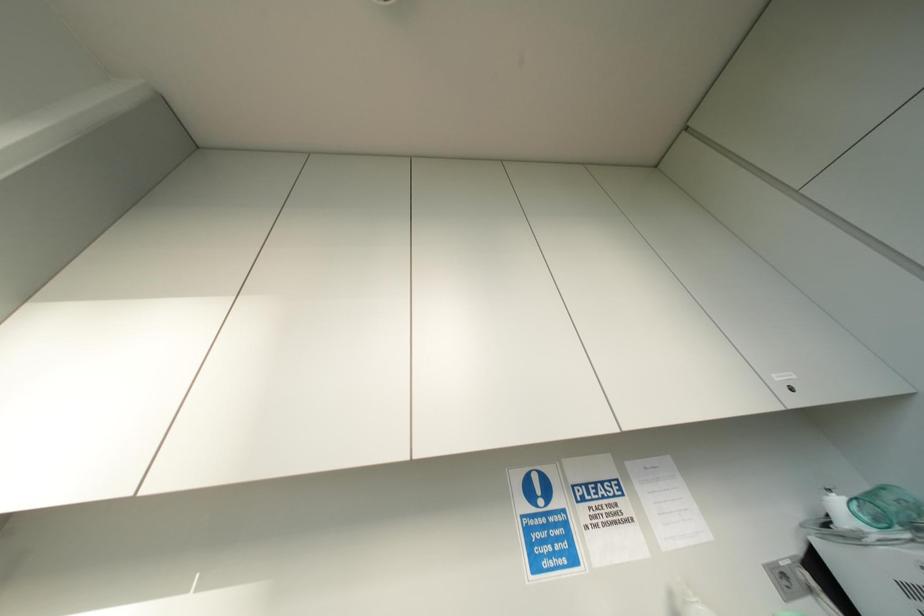
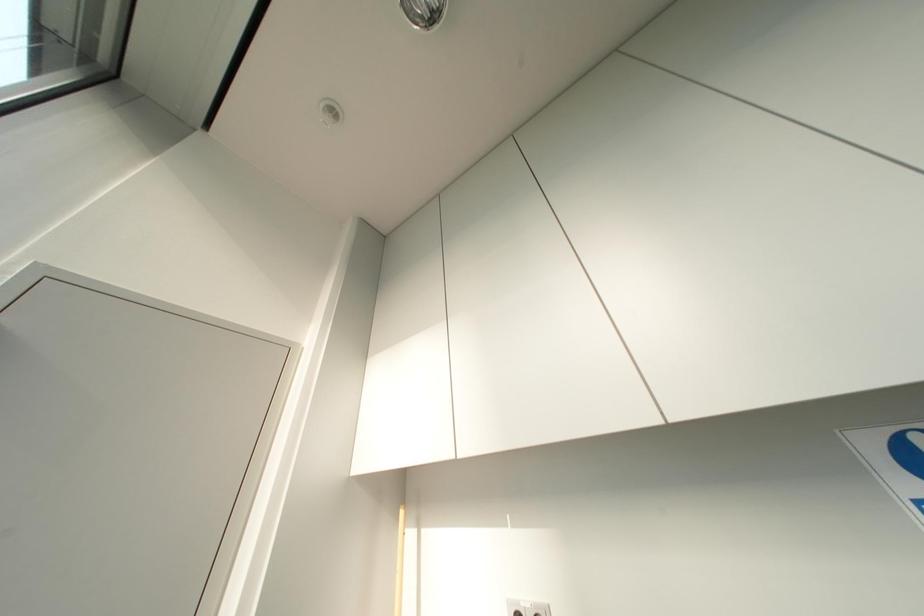
Question: The camera is either moving clockwise (left) or counter-clockwise (right) around the object. The first image is from the beginning of the video and the second image is from the end. Is the camera moving left or right when shooting the video?

Choices:
 (A) Left
 (B) Right

Answer: (B)